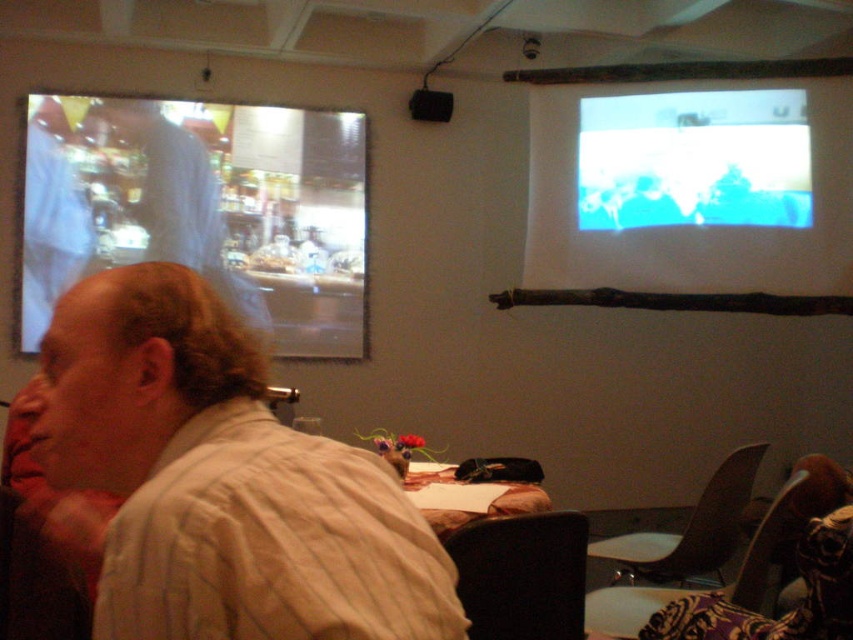
Question: Is the position of white striped shirt at left less distant than that of wooden table at center?

Choices:
 (A) no
 (B) yes

Answer: (B)

Question: Considering the relative positions of blue matte screen at upper right and wooden table at center in the image provided, where is blue matte screen at upper right located with respect to wooden table at center?

Choices:
 (A) right
 (B) left

Answer: (A)

Question: Which object is positioned closest to the wooden table at center?

Choices:
 (A) white striped shirt at left
 (B) matte glass display at upper left
 (C) blue matte screen at upper right

Answer: (A)

Question: Which point is closer to the camera?

Choices:
 (A) wooden table at center
 (B) blue matte screen at upper right
 (C) matte glass display at upper left
 (D) white striped shirt at left

Answer: (D)

Question: Does matte glass display at upper left appear on the right side of blue matte screen at upper right?

Choices:
 (A) no
 (B) yes

Answer: (A)

Question: Which is nearer to the wooden table at center?

Choices:
 (A) matte glass display at upper left
 (B) white striped shirt at left
 (C) blue matte screen at upper right

Answer: (B)